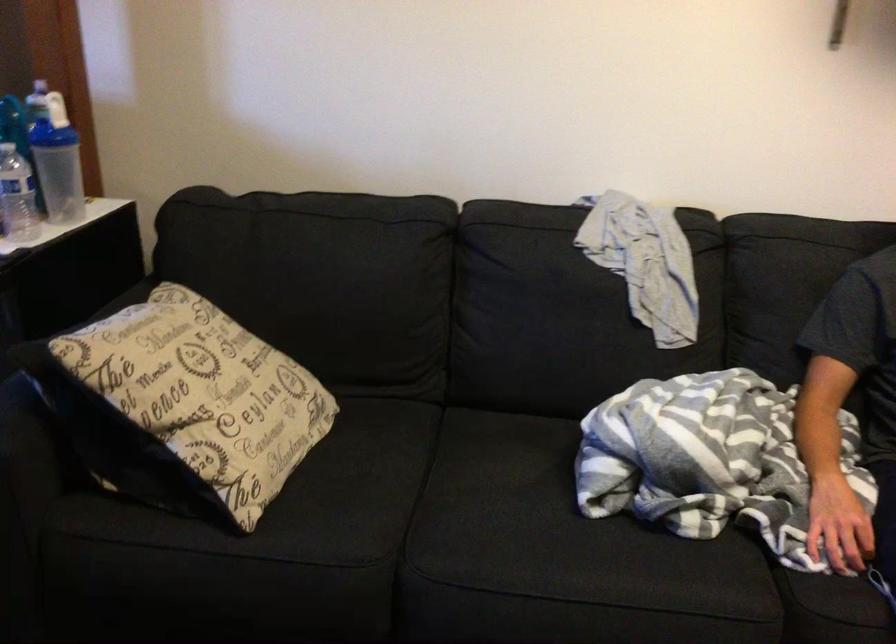
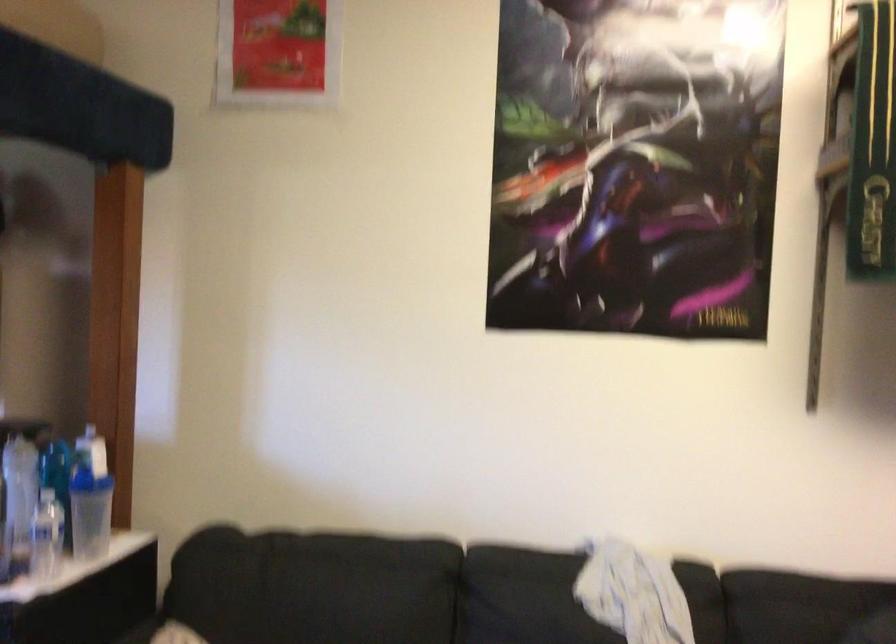
Question: The first image is from the beginning of the video and the second image is from the end. How did the camera likely rotate when shooting the video?

Choices:
 (A) Left
 (B) Right
 (C) Up
 (D) Down

Answer: (C)